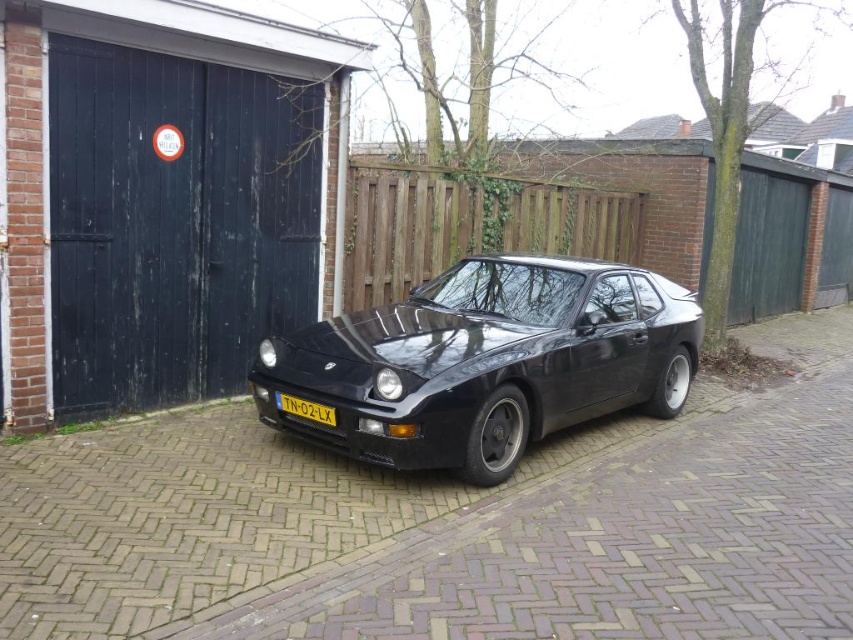
Who is lower down, black wood/glass garage door at left or yellow matte license plate at center?

yellow matte license plate at center

This screenshot has height=640, width=853. What do you see at coordinates (173, 224) in the screenshot?
I see `black wood/glass garage door at left` at bounding box center [173, 224].

Who is more forward, (202, 220) or (283, 400)?

Point (283, 400)

This screenshot has height=640, width=853. I want to click on black wood/glass garage door at left, so 173,224.

Which is behind, point (212, 88) or point (258, 349)?

Positioned behind is point (212, 88).

Between black wood/glass garage door at left and glossy black car at center, which one appears on the left side from the viewer's perspective?

From the viewer's perspective, black wood/glass garage door at left appears more on the left side.

Is point (300, 260) positioned before point (610, 321)?

No, it is not.

I want to click on black wood/glass garage door at left, so click(x=173, y=224).

Who is more distant from viewer, [326,355] or [300,401]?

Positioned behind is point [326,355].

The width and height of the screenshot is (853, 640). What do you see at coordinates (486, 362) in the screenshot?
I see `glossy black car at center` at bounding box center [486, 362].

The height and width of the screenshot is (640, 853). I want to click on glossy black car at center, so click(x=486, y=362).